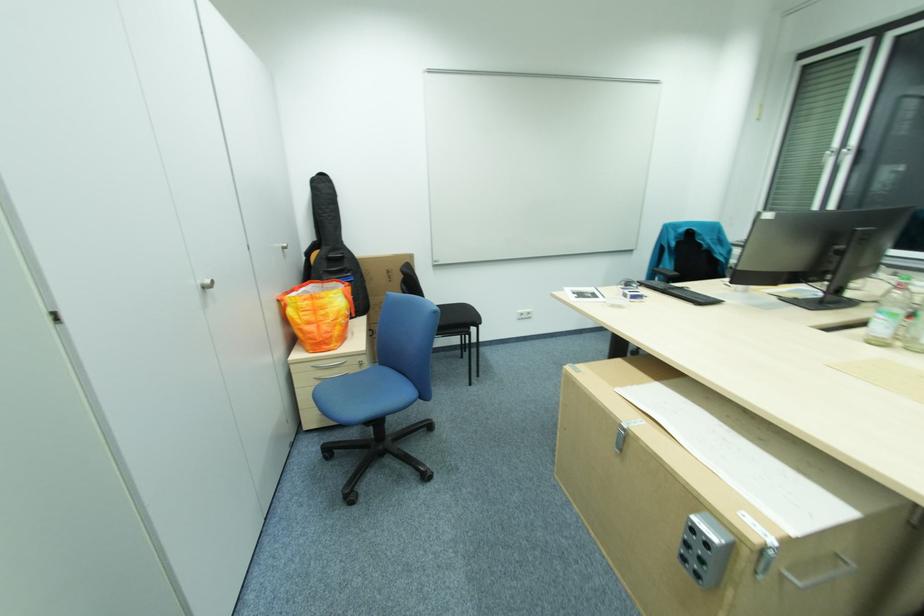
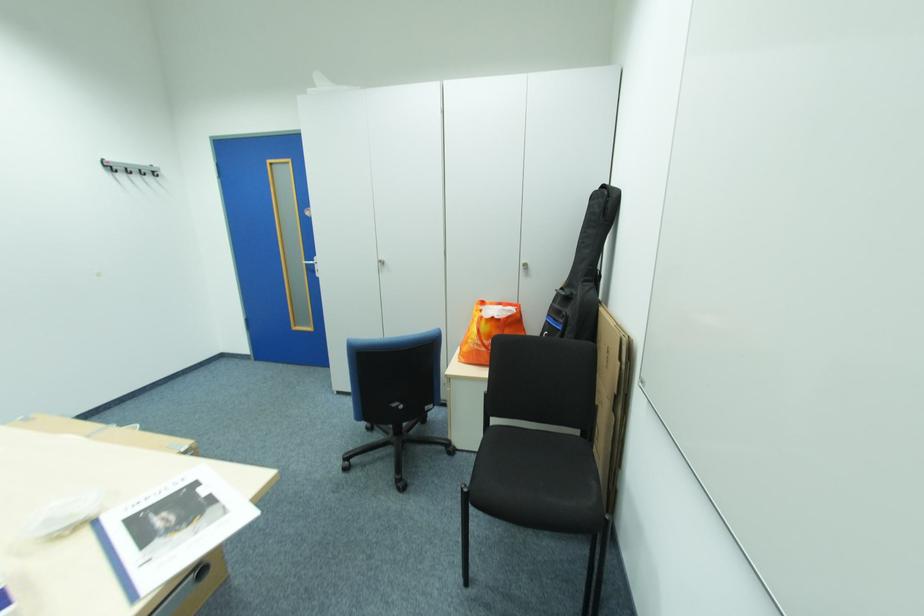
Find the pixel in the second image that matches point 353,322 in the first image.

(480, 345)